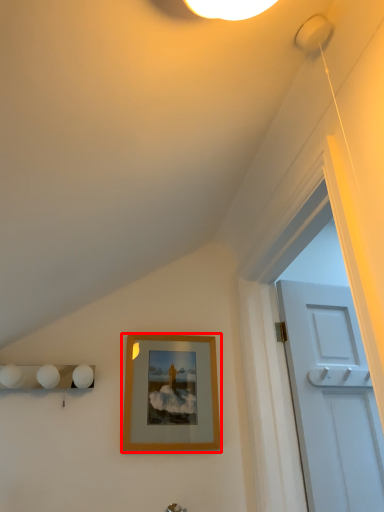
Question: From the image's perspective, considering the relative positions of picture frame (annotated by the red box) and door handle in the image provided, where is picture frame (annotated by the red box) located with respect to the staircase?

Choices:
 (A) below
 (B) above

Answer: (B)